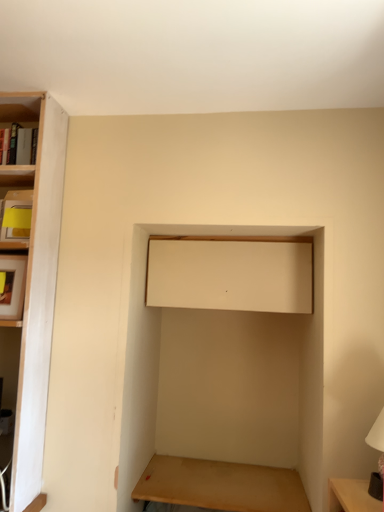
Question: Is white glossy table lamp at lower right behind wooden table at lower center?

Choices:
 (A) yes
 (B) no

Answer: (B)

Question: Considering the relative sizes of white glossy table lamp at lower right and wooden table at lower center in the image provided, is white glossy table lamp at lower right bigger than wooden table at lower center?

Choices:
 (A) yes
 (B) no

Answer: (B)

Question: Can you confirm if white glossy table lamp at lower right is positioned to the right of wooden table at lower center?

Choices:
 (A) no
 (B) yes

Answer: (B)

Question: From a real-world perspective, is white glossy table lamp at lower right under wooden table at lower center?

Choices:
 (A) no
 (B) yes

Answer: (A)

Question: Is white glossy table lamp at lower right oriented towards wooden table at lower center?

Choices:
 (A) yes
 (B) no

Answer: (B)

Question: Considering the relative sizes of white glossy table lamp at lower right and wooden table at lower center in the image provided, is white glossy table lamp at lower right shorter than wooden table at lower center?

Choices:
 (A) yes
 (B) no

Answer: (B)

Question: Considering the relative sizes of wooden table at lower center and beige matte cabinet at upper center in the image provided, is wooden table at lower center wider than beige matte cabinet at upper center?

Choices:
 (A) no
 (B) yes

Answer: (B)

Question: Can you confirm if wooden table at lower center is positioned to the right of beige matte cabinet at upper center?

Choices:
 (A) no
 (B) yes

Answer: (A)

Question: Is wooden table at lower center completely or partially outside of beige matte cabinet at upper center?

Choices:
 (A) no
 (B) yes

Answer: (B)

Question: From the image's perspective, does wooden table at lower center appear lower than beige matte cabinet at upper center?

Choices:
 (A) no
 (B) yes

Answer: (B)

Question: Are wooden table at lower center and beige matte cabinet at upper center located far from each other?

Choices:
 (A) yes
 (B) no

Answer: (B)

Question: Is wooden table at lower center thinner than beige matte cabinet at upper center?

Choices:
 (A) yes
 (B) no

Answer: (B)

Question: Is beige matte cabinet at upper center wider than white glossy table lamp at lower right?

Choices:
 (A) yes
 (B) no

Answer: (A)